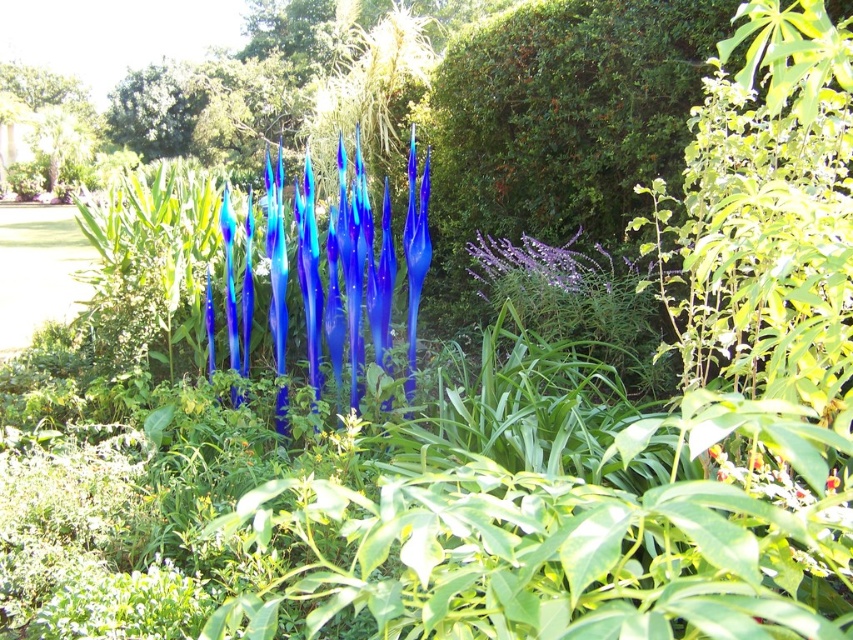
You are standing in the garden and want to place a small potted plant exactly where the glossy glass spikes at center are located. Is this possible?

The glossy glass spikes at center are located at point (344, 275), so placing a potted plant there would not be possible as the space is already occupied by the glossy glass spikes at center.